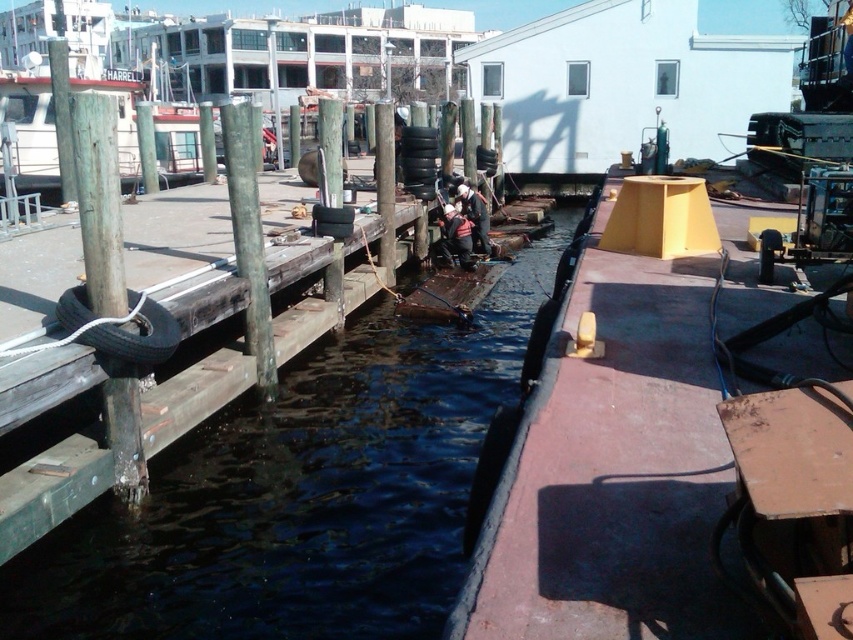
Question: Which point appears farthest from the camera in this image?

Choices:
 (A) (392, 460)
 (B) (158, 161)

Answer: (B)

Question: Can you confirm if dark wood waterway at center is bigger than white fabric jacket at center?

Choices:
 (A) yes
 (B) no

Answer: (A)

Question: Among these points, which one is nearest to the camera?

Choices:
 (A) (799, 484)
 (B) (178, 544)
 (C) (450, 234)
 (D) (15, 97)

Answer: (A)

Question: Can you confirm if white glossy boat at upper left is positioned below red knit cap at center?

Choices:
 (A) yes
 (B) no

Answer: (B)

Question: Is red knit cap at center positioned at the back of white fabric jacket at center?

Choices:
 (A) yes
 (B) no

Answer: (B)

Question: Which point appears farthest from the camera in this image?

Choices:
 (A) (471, 225)
 (B) (166, 138)
 (C) (331, 612)

Answer: (B)